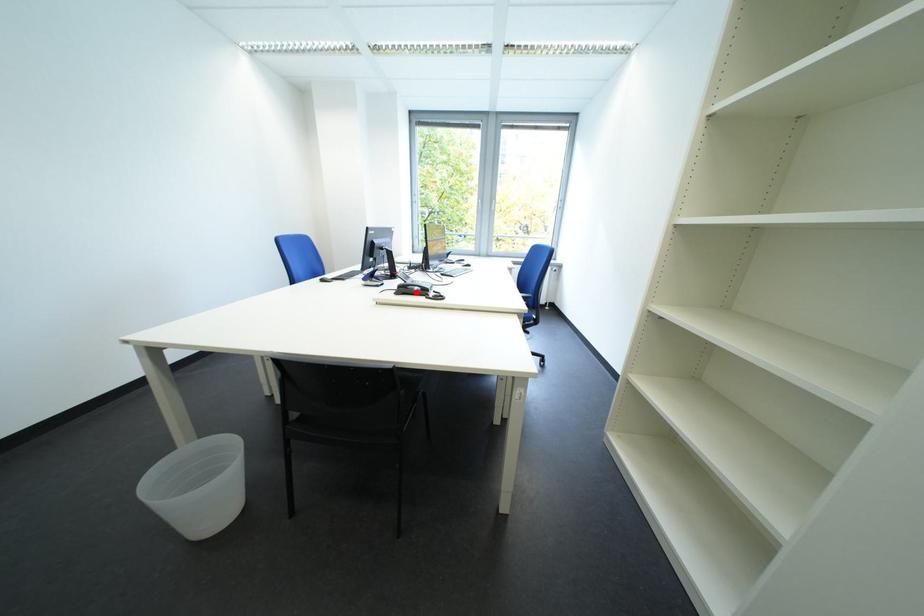
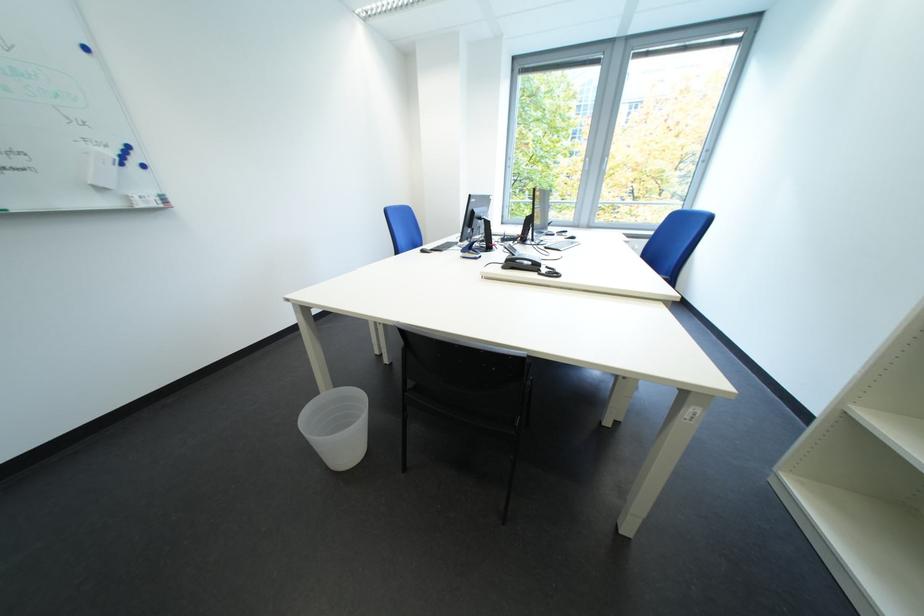
The point at the highlighted location is marked in the first image. Where is the corresponding point in the second image?

(524, 265)